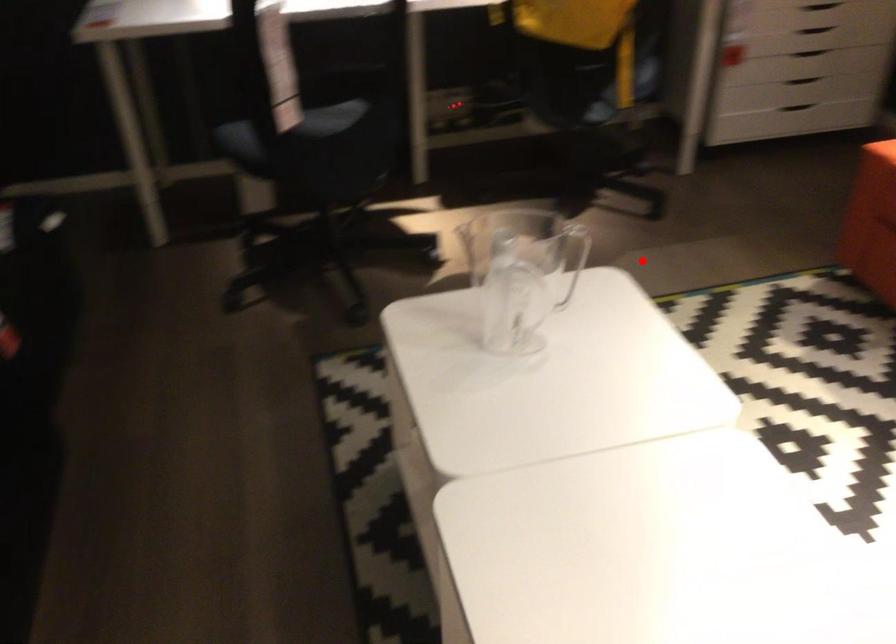
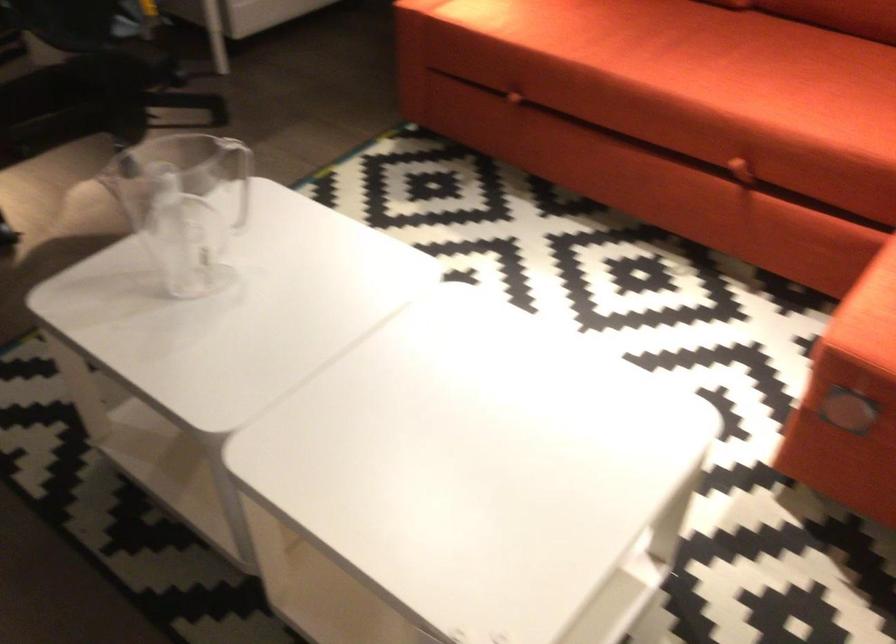
The point at the highlighted location is marked in the first image. Where is the corresponding point in the second image?

(238, 176)